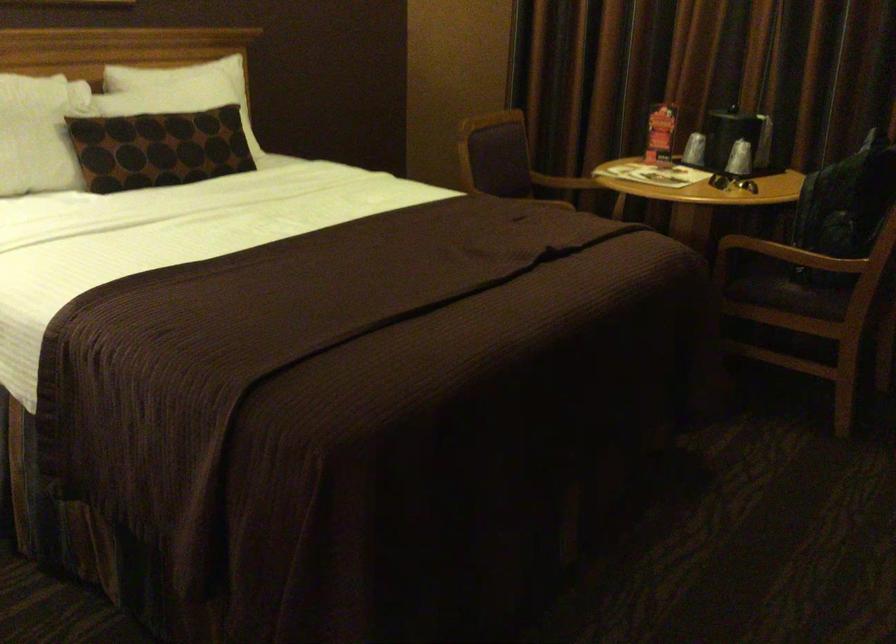
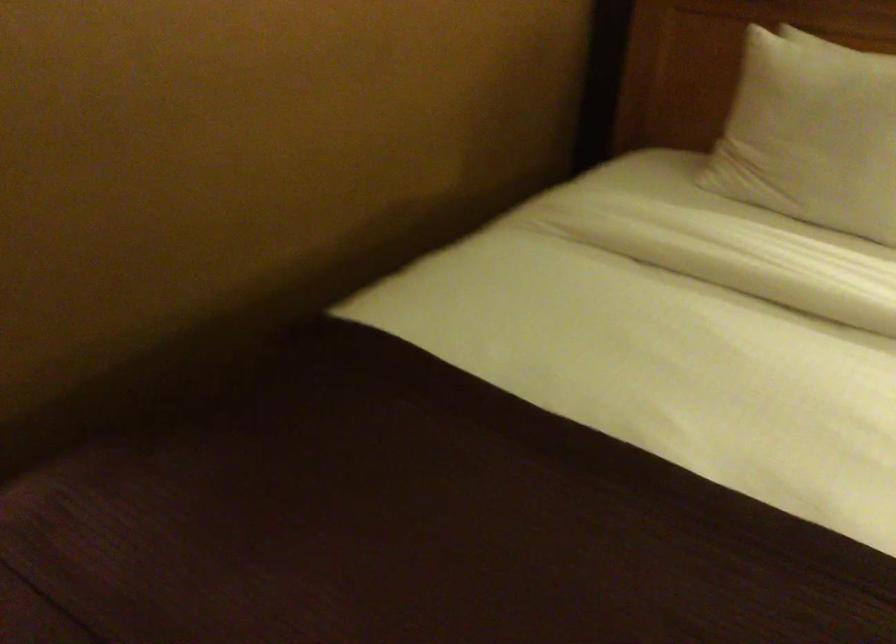
The first image is from the beginning of the video and the second image is from the end. How did the camera likely rotate when shooting the video?

The rotation direction of the camera is left-down.